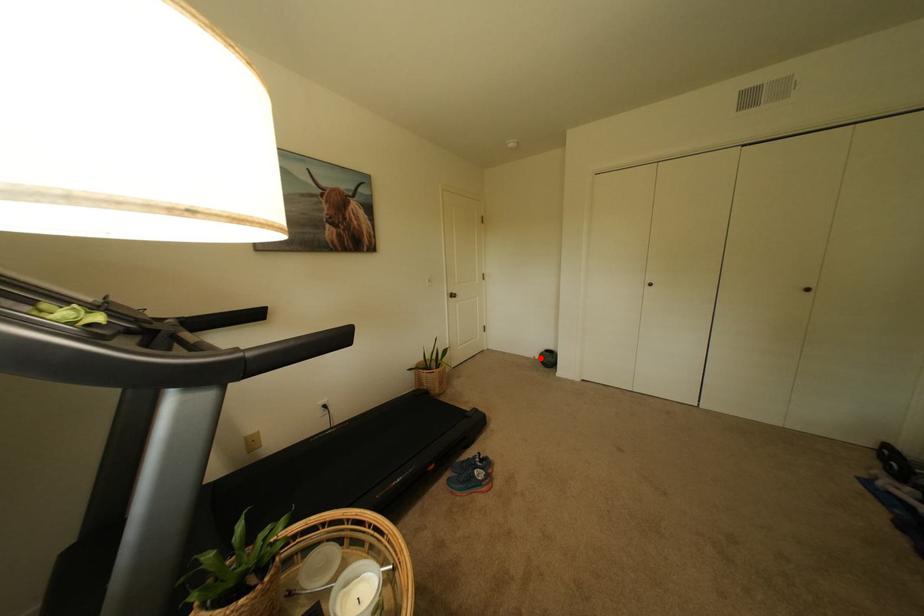
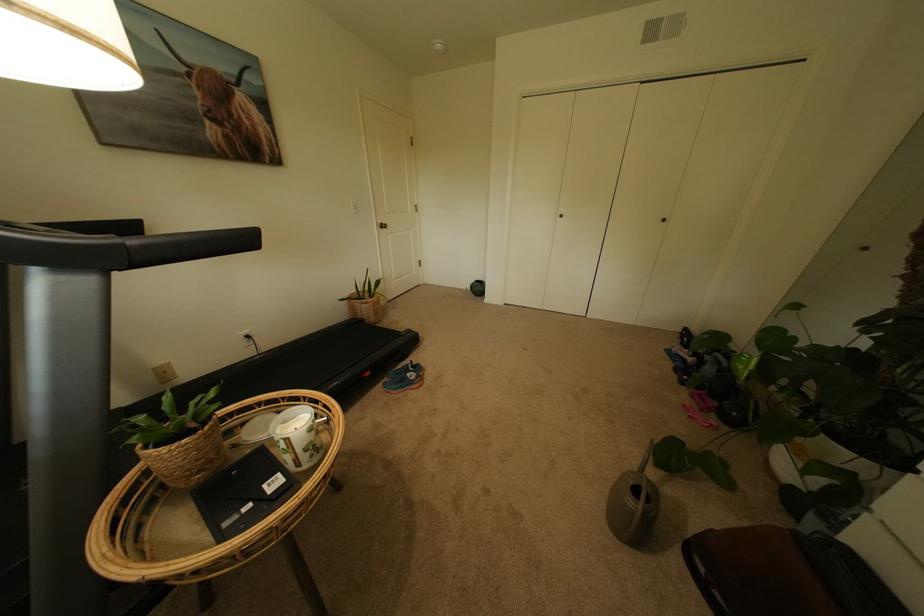
Find the pixel in the second image that matches the highlighted location in the first image.

(473, 289)